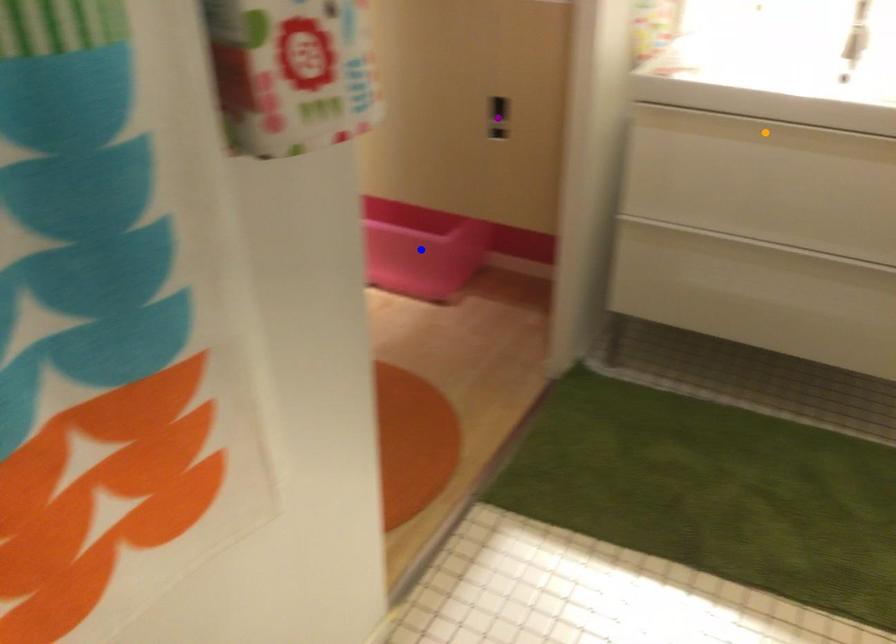
Order these from nearest to farthest:
1. blue point
2. orange point
3. purple point

blue point → purple point → orange point